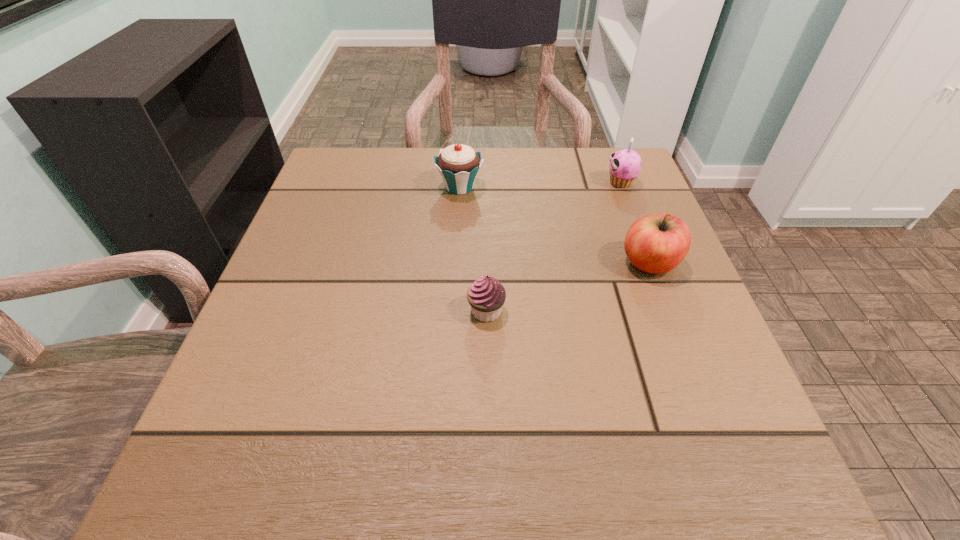
Where is `vacant point that satisfies the following two spatial constraints: 1. on the face of the rightmost cupcake; 2. on the front side of the apple`? The width and height of the screenshot is (960, 540). vacant point that satisfies the following two spatial constraints: 1. on the face of the rightmost cupcake; 2. on the front side of the apple is located at coordinates (652, 263).

Where is `free space that satisfies the following two spatial constraints: 1. on the face of the rightmost cupcake; 2. on the front side of the apple`? This screenshot has width=960, height=540. free space that satisfies the following two spatial constraints: 1. on the face of the rightmost cupcake; 2. on the front side of the apple is located at coordinates (652, 263).